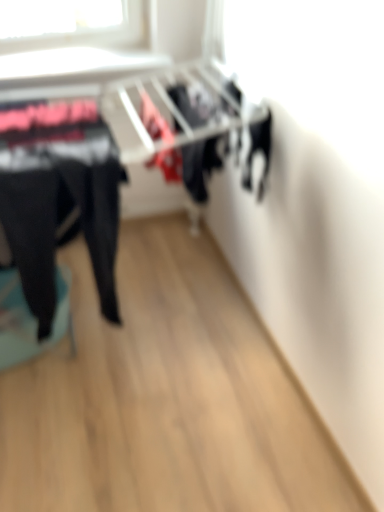
Describe the element at coordinates (59, 196) in the screenshot. The height and width of the screenshot is (512, 384). I see `black fabric pants at left` at that location.

This screenshot has width=384, height=512. Find the location of `black fabric pants at left`. black fabric pants at left is located at coordinates (59, 196).

Find the location of `matte black stool at left`. matte black stool at left is located at coordinates (30, 319).

Describe the element at coordinates (30, 319) in the screenshot. I see `matte black stool at left` at that location.

Locate an element on the screen. Image resolution: width=384 pixels, height=512 pixels. black fabric pants at left is located at coordinates (59, 196).

Which is more to the left, matte black stool at left or black fabric pants at left?

Positioned to the left is matte black stool at left.

Does matte black stool at left lie in front of black fabric pants at left?

No, the depth of matte black stool at left is greater than that of black fabric pants at left.

Considering the points (4, 283) and (46, 146), which point is behind, point (4, 283) or point (46, 146)?

Positioned behind is point (4, 283).

From the image's perspective, who appears lower, matte black stool at left or black fabric pants at left?

matte black stool at left appears lower in the image.

From a real-world perspective, is matte black stool at left above or below black fabric pants at left?

matte black stool at left is situated lower than black fabric pants at left in the real world.

From the picture: Can you confirm if matte black stool at left is thinner than black fabric pants at left?

Incorrect, the width of matte black stool at left is not less than that of black fabric pants at left.

Can you confirm if matte black stool at left is shorter than black fabric pants at left?

Correct, matte black stool at left is not as tall as black fabric pants at left.

Considering the sizes of matte black stool at left and black fabric pants at left in the image, is matte black stool at left bigger or smaller than black fabric pants at left?

matte black stool at left is smaller than black fabric pants at left.

Is black fabric pants at left a part of matte black stool at left?

Definitely not — black fabric pants at left is not inside matte black stool at left.

Is the surface of matte black stool at left in direct contact with black fabric pants at left?

matte black stool at left and black fabric pants at left are clearly separated.

Is matte black stool at left oriented towards black fabric pants at left?

No, matte black stool at left is not facing towards black fabric pants at left.

How many degrees apart are the facing directions of matte black stool at left and black fabric pants at left?

They differ by 14.3 degrees in their facing directions.

How distant is matte black stool at left from black fabric pants at left?

A distance of 17.85 inches exists between matte black stool at left and black fabric pants at left.

Where is `clothing on the right of matte black stool at left`? clothing on the right of matte black stool at left is located at coordinates (59, 196).

Can you confirm if black fabric pants at left is positioned to the right of matte black stool at left?

Yes.

Which is behind, black fabric pants at left or matte black stool at left?

matte black stool at left is more distant.

Is point (61, 125) positioned after point (5, 295)?

No, it is not.

From the image's perspective, is black fabric pants at left located beneath matte black stool at left?

No, from the image's perspective, black fabric pants at left is not below matte black stool at left.

From a real-world perspective, which is physically above, black fabric pants at left or matte black stool at left?

black fabric pants at left is physically above.

Which of these two, black fabric pants at left or matte black stool at left, is thinner?

With smaller width is black fabric pants at left.

Considering the sizes of objects black fabric pants at left and matte black stool at left in the image provided, who is taller, black fabric pants at left or matte black stool at left?

black fabric pants at left is taller.

Can you confirm if black fabric pants at left is bigger than matte black stool at left?

Yes, black fabric pants at left is bigger than matte black stool at left.

Would you say black fabric pants at left is inside or outside matte black stool at left?

black fabric pants at left is located beyond the bounds of matte black stool at left.

Is there a large distance between black fabric pants at left and matte black stool at left?

black fabric pants at left is actually quite close to matte black stool at left.

Is black fabric pants at left looking in the opposite direction of matte black stool at left?

That's not correct — black fabric pants at left is not looking away from matte black stool at left.

How different are the orientations of black fabric pants at left and matte black stool at left in degrees?

The angular difference between black fabric pants at left and matte black stool at left is 14.3 degrees.

Find the location of a particular element. The width and height of the screenshot is (384, 512). clothing on the right of the matte black stool at left is located at coordinates (59, 196).

You are a GUI agent. You are given a task and a screenshot of the screen. Output one action in this format:
    pyautogui.click(x=<x>, y=<y>)
    Task: Click on the furniture that appears below the black fabric pants at left (from the image's perspective)
    The height and width of the screenshot is (512, 384).
    Given the screenshot: What is the action you would take?
    pyautogui.click(x=30, y=319)

I want to click on furniture behind the black fabric pants at left, so click(30, 319).